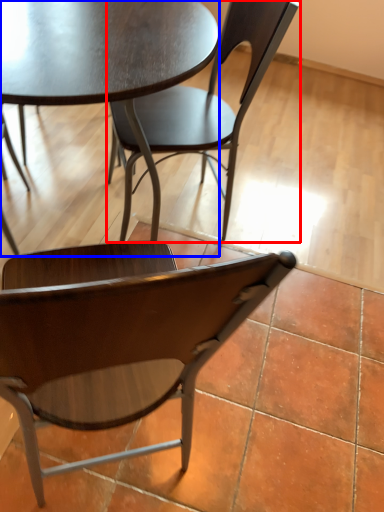
Question: Which object appears closest to the camera in this image, chair (highlighted by a red box) or coffee table (highlighted by a blue box)?

Choices:
 (A) chair
 (B) coffee table

Answer: (B)